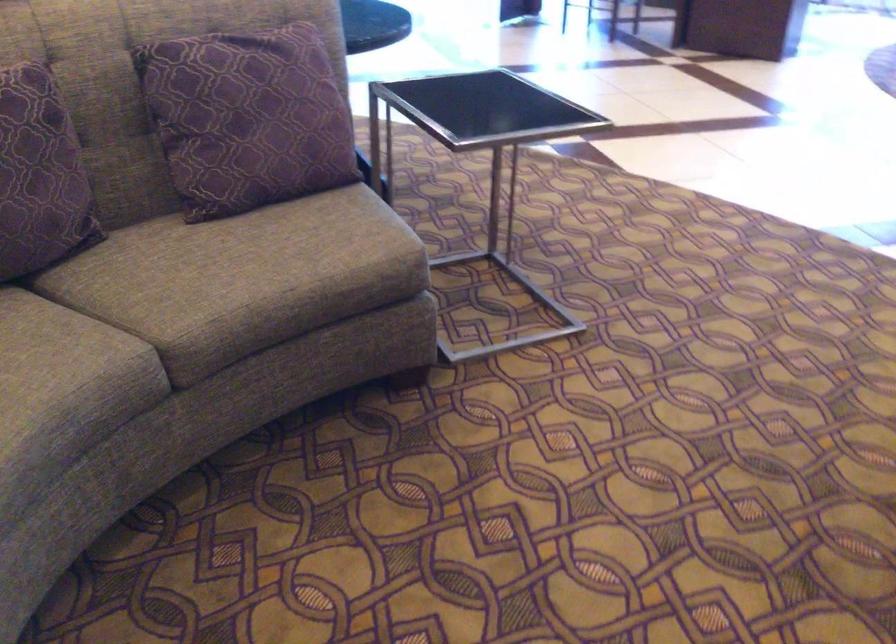
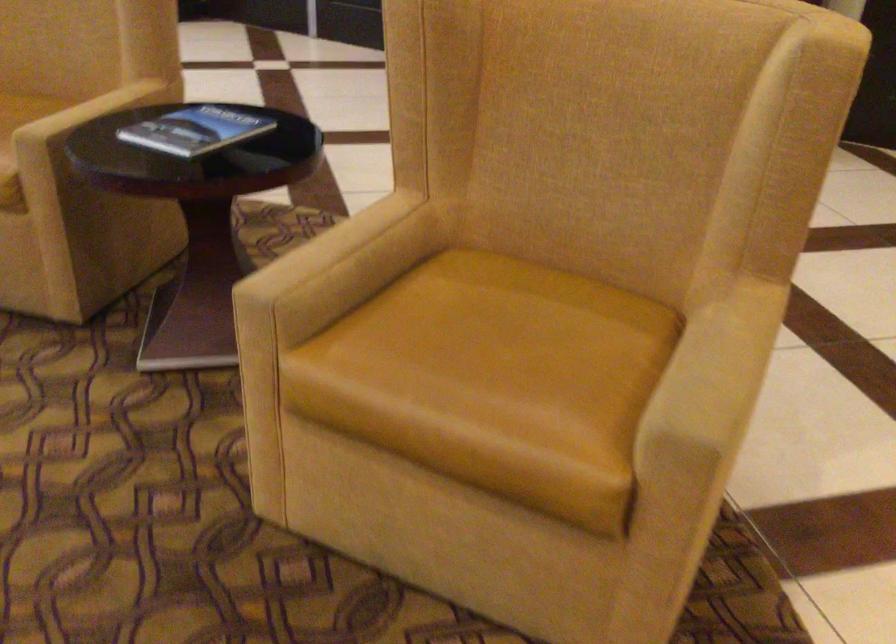
First-person continuous shooting, in which direction is the camera rotating?

The rotation direction of the camera is right-down.